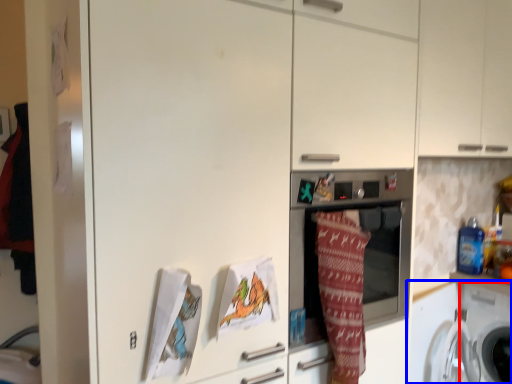
Question: Which object is further to the camera taking this photo, washing machine (highlighted by a red box) or washing machine (highlighted by a blue box)?

Choices:
 (A) washing machine
 (B) washing machine

Answer: (A)